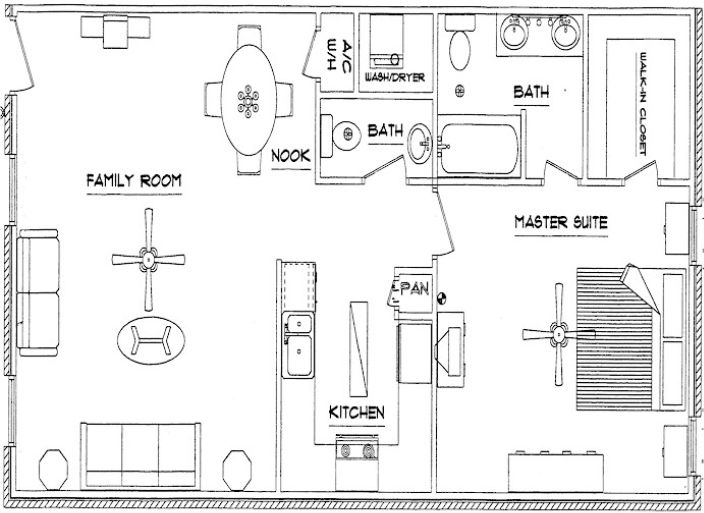
Where is `tub`? tub is located at coordinates (477, 155).